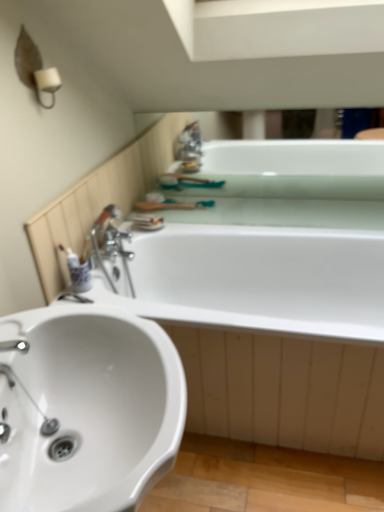
Identify the location of white glossy toothbrush at left. This screenshot has width=384, height=512. (76, 271).

What is the approximate height of white glossy sink at lower left?

It is 32.77 inches.

The height and width of the screenshot is (512, 384). I want to click on white glossy bathtub at center, the 2th bath from the top, so click(x=275, y=295).

Looking at this image, considering the relative sizes of white glossy sink at lower left and white glossy bathtub at upper center, the second bath from the bottom, in the image provided, is white glossy sink at lower left smaller than white glossy bathtub at upper center, the second bath from the bottom,?

Incorrect, white glossy sink at lower left is not smaller in size than white glossy bathtub at upper center, the second bath from the bottom.

From a real-world perspective, which object rests below the other?

From a 3D spatial view, white glossy sink at lower left is below.

Considering the sizes of white glossy sink at lower left and white glossy bathtub at upper center, the second bath from the bottom, in the image, is white glossy sink at lower left taller or shorter than white glossy bathtub at upper center, the second bath from the bottom,?

Clearly, white glossy sink at lower left is taller compared to white glossy bathtub at upper center, the second bath from the bottom.

The height and width of the screenshot is (512, 384). I want to click on sink on the left of the white glossy bathtub at upper center, the second bath from the bottom, so (x=88, y=408).

Consider the image. Considering the relative positions of white glossy bathtub at center, the 2th bath from the top, and white glossy bathtub at upper center, the second bath from the bottom, in the image provided, is white glossy bathtub at center, the 2th bath from the top, to the right of white glossy bathtub at upper center, the second bath from the bottom, from the viewer's perspective?

No, white glossy bathtub at center, the 2th bath from the top, is not to the right of white glossy bathtub at upper center, the second bath from the bottom.

In terms of width, does white glossy bathtub at center, the 2th bath from the top, look wider or thinner when compared to white glossy bathtub at upper center, the second bath from the bottom?

Clearly, white glossy bathtub at center, the 2th bath from the top, has more width compared to white glossy bathtub at upper center, the second bath from the bottom.

From a real-world perspective, is white glossy bathtub at center, the 2th bath from the top, beneath white glossy bathtub at upper center, the first bath when ordered from top to bottom?

Indeed, from a real-world perspective, white glossy bathtub at center, the 2th bath from the top, is positioned beneath white glossy bathtub at upper center, the first bath when ordered from top to bottom.

I want to click on bath above the white glossy bathtub at center, the 2th bath from the top (from the image's perspective), so click(297, 168).

Who is bigger, white glossy bathtub at upper center, the first bath when ordered from top to bottom, or white glossy bathtub at center, the 2th bath from the top?

white glossy bathtub at center, the 2th bath from the top.

Which object is thinner, white glossy bathtub at upper center, the second bath from the bottom, or white glossy bathtub at center, the 2th bath from the top?

white glossy bathtub at upper center, the second bath from the bottom.

From a real-world perspective, is white glossy bathtub at upper center, the first bath when ordered from top to bottom, positioned over white glossy bathtub at center, which is the 1th bath from bottom to top, based on gravity?

Yes, from a real-world perspective, white glossy bathtub at upper center, the first bath when ordered from top to bottom, is on top of white glossy bathtub at center, which is the 1th bath from bottom to top.

Would you say white glossy bathtub at center, which is the 1th bath from bottom to top, is to the left or to the right of white glossy toothbrush at left in the picture?

Clearly, white glossy bathtub at center, which is the 1th bath from bottom to top, is on the right of white glossy toothbrush at left in the image.

Considering the positions of objects white glossy bathtub at center, the 2th bath from the top, and white glossy toothbrush at left in the image provided, who is behind, white glossy bathtub at center, the 2th bath from the top, or white glossy toothbrush at left?

white glossy toothbrush at left is behind.

Consider the image. Who is taller, white glossy bathtub at center, which is the 1th bath from bottom to top, or white glossy toothbrush at left?

Standing taller between the two is white glossy bathtub at center, which is the 1th bath from bottom to top.

From the image's perspective, which one is positioned higher, white glossy toothbrush at left or white glossy bathtub at center, which is the 1th bath from bottom to top?

white glossy toothbrush at left.

Which is closer to the camera, [87,284] or [326,381]?

Point [87,284] appears to be farther away from the viewer than point [326,381].

Is white glossy toothbrush at left in contact with white glossy bathtub at center, which is the 1th bath from bottom to top?

Result: No.

Could you tell me if white glossy toothbrush at left is facing white glossy bathtub at center, the 2th bath from the top?

No, white glossy toothbrush at left is not aimed at white glossy bathtub at center, the 2th bath from the top.

Between white glossy bathtub at upper center, the first bath when ordered from top to bottom, and white glossy sink at lower left, which one is positioned in front?

white glossy sink at lower left is in front.

Based on their sizes in the image, would you say white glossy bathtub at upper center, the second bath from the bottom, is bigger or smaller than white glossy sink at lower left?

Considering their sizes, white glossy bathtub at upper center, the second bath from the bottom, takes up less space than white glossy sink at lower left.

From the image's perspective, which is above, white glossy bathtub at upper center, the second bath from the bottom, or white glossy sink at lower left?

white glossy bathtub at upper center, the second bath from the bottom, from the image's perspective.

How far apart are white glossy bathtub at upper center, the first bath when ordered from top to bottom, and white glossy sink at lower left?

white glossy bathtub at upper center, the first bath when ordered from top to bottom, is 5.37 feet away from white glossy sink at lower left.

Is white glossy toothbrush at left taller than white glossy sink at lower left?

No.

Measure the distance between white glossy toothbrush at left and white glossy sink at lower left.

white glossy toothbrush at left is 28.36 inches away from white glossy sink at lower left.

Consider the image. Considering the relative positions of white glossy toothbrush at left and white glossy sink at lower left in the image provided, is white glossy toothbrush at left to the left of white glossy sink at lower left from the viewer's perspective?

Yes.

Is white glossy toothbrush at left smaller than white glossy sink at lower left?

Yes, white glossy toothbrush at left is smaller than white glossy sink at lower left.

The height and width of the screenshot is (512, 384). Identify the location of bath that is the 2nd one when counting backward from the white glossy sink at lower left. (297, 168).

Locate an element on the screen. The image size is (384, 512). bath that appears in front of the white glossy bathtub at upper center, the first bath when ordered from top to bottom is located at coordinates (275, 295).

When comparing their distances from white glossy toothbrush at left, does white glossy bathtub at center, which is the 1th bath from bottom to top, or white glossy sink at lower left seem closer?

white glossy sink at lower left lies closer to white glossy toothbrush at left than the other object.

When comparing their distances from white glossy sink at lower left, does white glossy bathtub at center, the 2th bath from the top, or white glossy toothbrush at left seem further?

white glossy bathtub at center, the 2th bath from the top, is further to white glossy sink at lower left.

Based on their spatial positions, is white glossy bathtub at center, the 2th bath from the top, or white glossy toothbrush at left closer to white glossy bathtub at upper center, the second bath from the bottom?

white glossy bathtub at center, the 2th bath from the top.

Looking at the image, which one is located closer to white glossy bathtub at upper center, the second bath from the bottom, white glossy toothbrush at left or white glossy sink at lower left?

white glossy toothbrush at left lies closer to white glossy bathtub at upper center, the second bath from the bottom, than the other object.

Based on their spatial positions, is white glossy sink at lower left or white glossy bathtub at center, the 2th bath from the top, closer to white glossy toothbrush at left?

white glossy sink at lower left is positioned closer to the anchor white glossy toothbrush at left.

Based on their spatial positions, is white glossy toothbrush at left or white glossy bathtub at upper center, the second bath from the bottom, further from white glossy sink at lower left?

Based on the image, white glossy bathtub at upper center, the second bath from the bottom, appears to be further to white glossy sink at lower left.

Which object lies further to the anchor point white glossy bathtub at center, which is the 1th bath from bottom to top, white glossy bathtub at upper center, the second bath from the bottom, or white glossy toothbrush at left?

Among the two, white glossy toothbrush at left is located further to white glossy bathtub at center, which is the 1th bath from bottom to top.

Based on their spatial positions, is white glossy bathtub at upper center, the first bath when ordered from top to bottom, or white glossy toothbrush at left further from white glossy sink at lower left?

white glossy bathtub at upper center, the first bath when ordered from top to bottom, lies further to white glossy sink at lower left than the other object.

This screenshot has height=512, width=384. In order to click on bath between white glossy toothbrush at left and white glossy bathtub at upper center, the first bath when ordered from top to bottom in this screenshot , I will do `click(275, 295)`.

Where is `toiletry between white glossy sink at lower left and white glossy bathtub at upper center, the second bath from the bottom, along the z-axis`? toiletry between white glossy sink at lower left and white glossy bathtub at upper center, the second bath from the bottom, along the z-axis is located at coordinates (76, 271).

At what (x,y) coordinates should I click in order to perform the action: click on bath positioned between white glossy sink at lower left and white glossy bathtub at upper center, the first bath when ordered from top to bottom, from near to far. Please return your answer as a coordinate pair (x, y). This screenshot has height=512, width=384. Looking at the image, I should click on (275, 295).

Locate an element on the screen. Image resolution: width=384 pixels, height=512 pixels. bath located between white glossy sink at lower left and white glossy toothbrush at left in the depth direction is located at coordinates (275, 295).